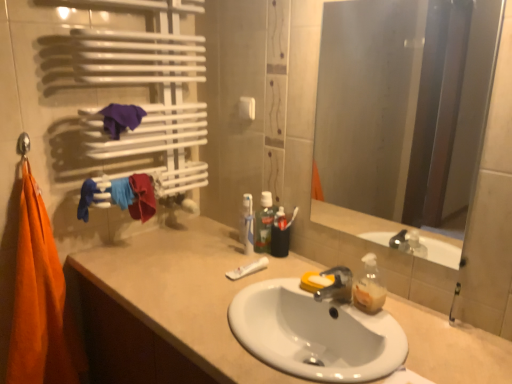
The height and width of the screenshot is (384, 512). What are the coordinates of `free space to the left of green translucent mouthwash at center` in the screenshot? It's located at (220, 254).